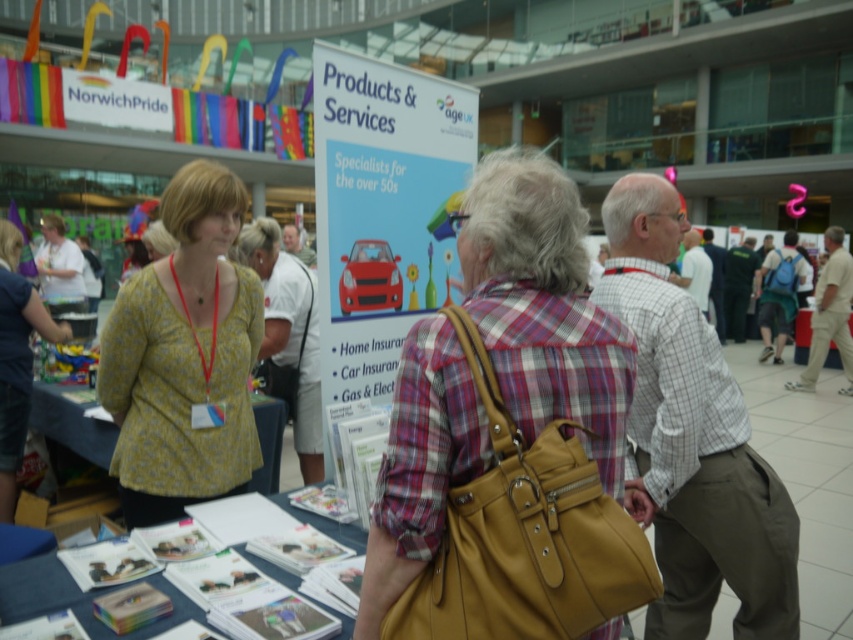
In the scene shown: You are at the event and want to approach the light gray checkered shirt at center to ask a question. Which direction should you move from the yellow floral blouse at left to reach them?

The yellow floral blouse at left is positioned on the left side of light gray checkered shirt at center, so you should move to the right to reach the light gray checkered shirt at center from the yellow floral blouse at left.

You are at the point marked as point (543,304) in the image. What object is located exactly at this point?

The leather handbag at center is located exactly at point (543,304).

You are at the event and want to locate the leather handbag at center. According to the 2D coordinates provided, what are its exact coordinates?

The leather handbag at center is located at the 2D coordinates point (543, 304).